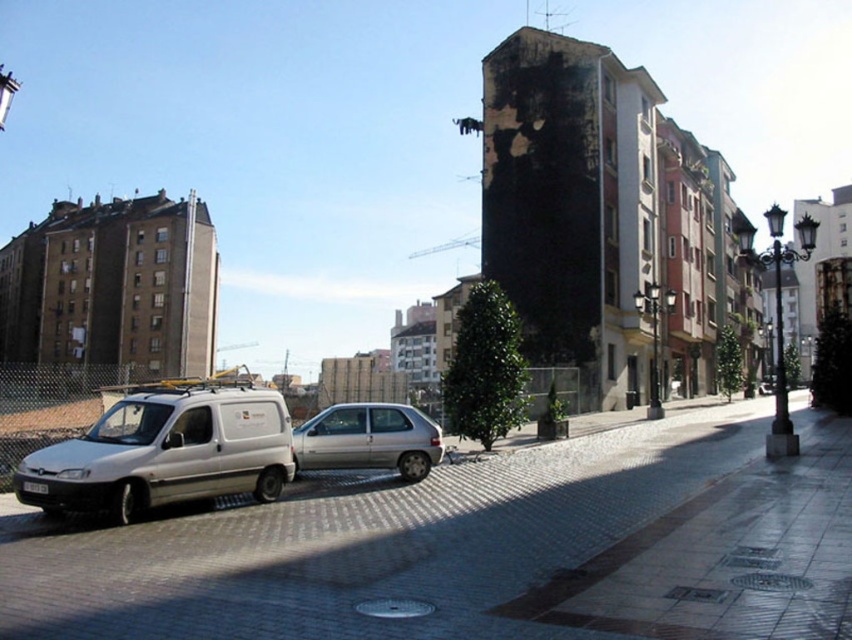
Is point (240, 385) more distant than point (327, 412)?

That is False.

The width and height of the screenshot is (852, 640). What are the coordinates of `white matte van at left` in the screenshot? It's located at (165, 451).

I want to click on white matte van at left, so click(x=165, y=451).

Is paved stone road at center closer to camera compared to silver metallic hatchback at center?

Yes, it is.

Between point (465, 566) and point (326, 467), which one is positioned in front?

Point (465, 566) is more forward.

The height and width of the screenshot is (640, 852). In order to click on paved stone road at center in this screenshot , I will do pyautogui.click(x=481, y=548).

Between paved stone road at center and white matte van at left, which one is positioned lower?

paved stone road at center is lower down.

Who is positioned more to the left, paved stone road at center or white matte van at left?

white matte van at left

Is point (393, 538) closer to viewer compared to point (183, 404)?

Yes, it is in front of point (183, 404).

Locate an element on the screen. paved stone road at center is located at coordinates (481, 548).